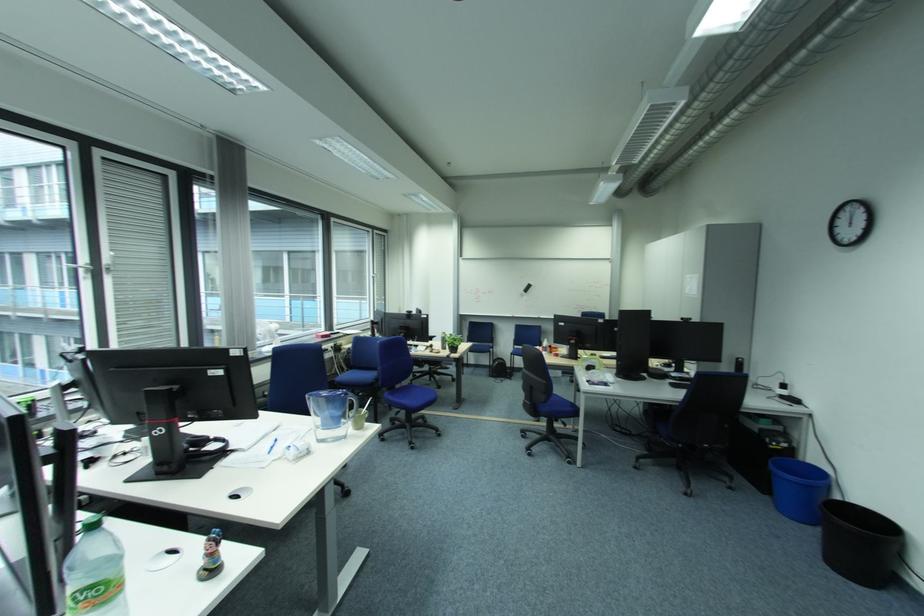
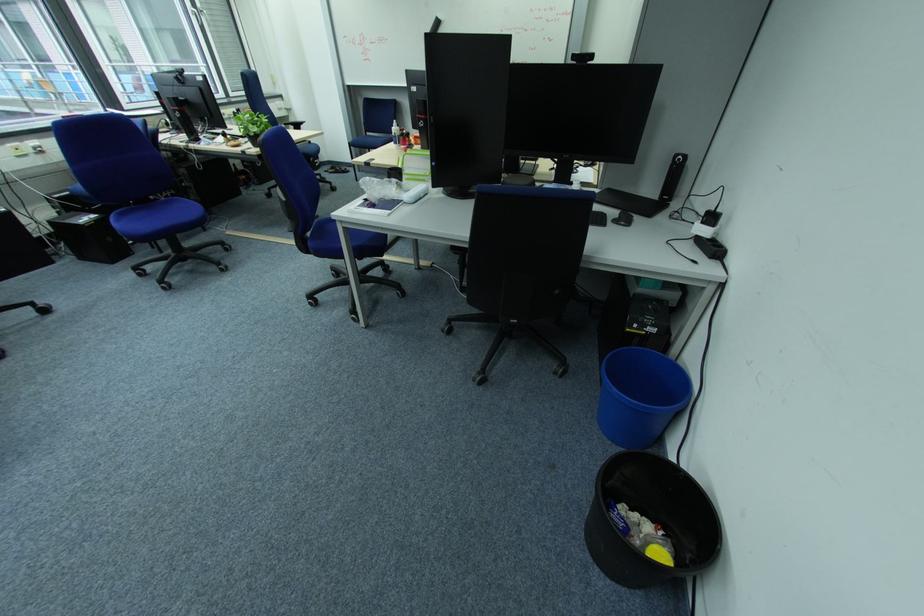
Find the pixel in the second image that matches [829,557] in the first image.

(596, 514)